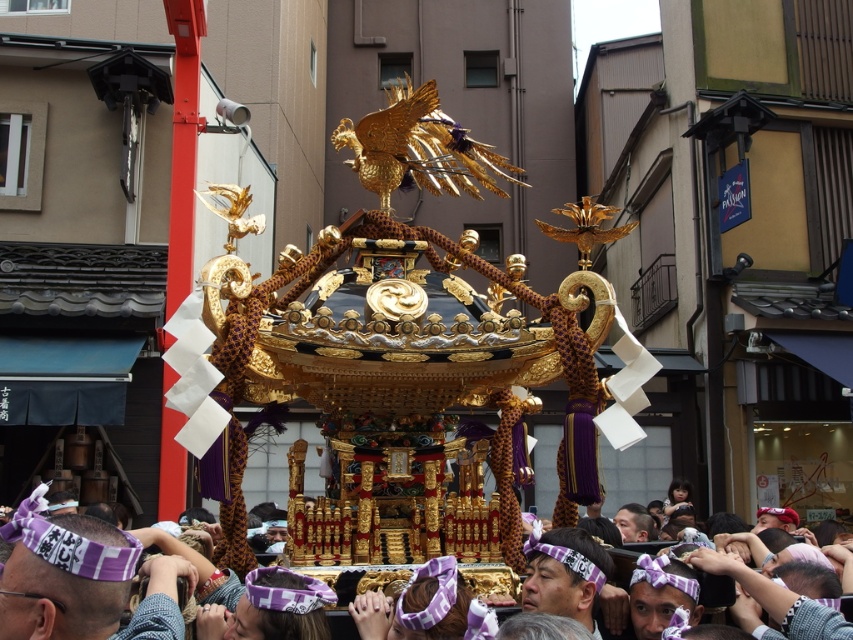
You are standing in the middle of the crowd at the Japanese festival. You see two points in the scene, one at point coordinates point (119, 554) and another at point (561, 541). Which point is closer to you?

Point (119, 554) is closer to the viewer than point (561, 541).

You are a photographer at the festival and want to capture a photo of both the gold ornate float at center and the purple fabric headband at center. Which object should you focus on first if you want to ensure both are in the frame without moving the camera?

The gold ornate float at center is located above the purple fabric headband at center, so focusing on the gold ornate float at center first will ensure both are in the frame since it is positioned higher up.

You are standing at the center of the festival grounds. You want to locate the gold ornate float at center. Which direction should you look to find it?

The gold ornate float at center is located at point coordinates of (x=62, y=573), so you should look towards the top right direction to find it.